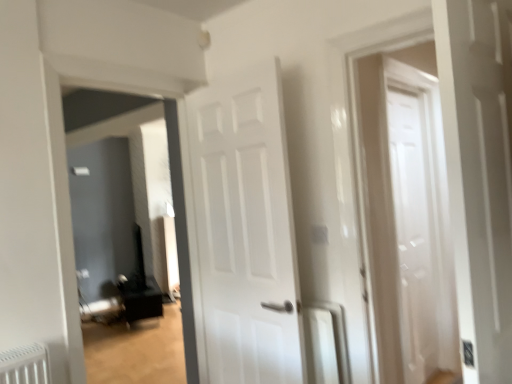
Question: Is matte black speaker at left outside white glossy door at center?

Choices:
 (A) no
 (B) yes

Answer: (B)

Question: Can you confirm if matte black speaker at left is positioned to the left of white glossy door at center?

Choices:
 (A) no
 (B) yes

Answer: (B)

Question: Are matte black speaker at left and white glossy door at center making contact?

Choices:
 (A) yes
 (B) no

Answer: (B)

Question: From a real-world perspective, is matte black speaker at left physically below white glossy door at center?

Choices:
 (A) no
 (B) yes

Answer: (B)

Question: Can you confirm if matte black speaker at left is shorter than white glossy door at center?

Choices:
 (A) no
 (B) yes

Answer: (A)

Question: From a real-world perspective, is white glossy radiator at center physically located above or below white glossy door at center?

Choices:
 (A) above
 (B) below

Answer: (B)

Question: From their relative heights in the image, would you say white glossy radiator at center is taller or shorter than white glossy door at center?

Choices:
 (A) short
 (B) tall

Answer: (A)

Question: From the image's perspective, is white glossy radiator at center positioned above or below white glossy door at center?

Choices:
 (A) below
 (B) above

Answer: (A)

Question: Does point (330, 326) appear closer or farther from the camera than point (196, 306)?

Choices:
 (A) closer
 (B) farther

Answer: (A)

Question: From the image's perspective, relative to white glossy radiator at center, is matte black speaker at left above or below?

Choices:
 (A) above
 (B) below

Answer: (A)

Question: Is point [74, 107] closer or farther from the camera than point [325, 380]?

Choices:
 (A) farther
 (B) closer

Answer: (A)

Question: Considering the positions of matte black speaker at left and white glossy radiator at center in the image, is matte black speaker at left taller or shorter than white glossy radiator at center?

Choices:
 (A) tall
 (B) short

Answer: (A)

Question: Relative to white glossy radiator at center, is matte black speaker at left in front or behind?

Choices:
 (A) behind
 (B) front

Answer: (A)

Question: From the image's perspective, relative to white glossy radiator at center, is white glossy door at center above or below?

Choices:
 (A) below
 (B) above

Answer: (B)

Question: Is white glossy door at center wider or thinner than white glossy radiator at center?

Choices:
 (A) wide
 (B) thin

Answer: (B)